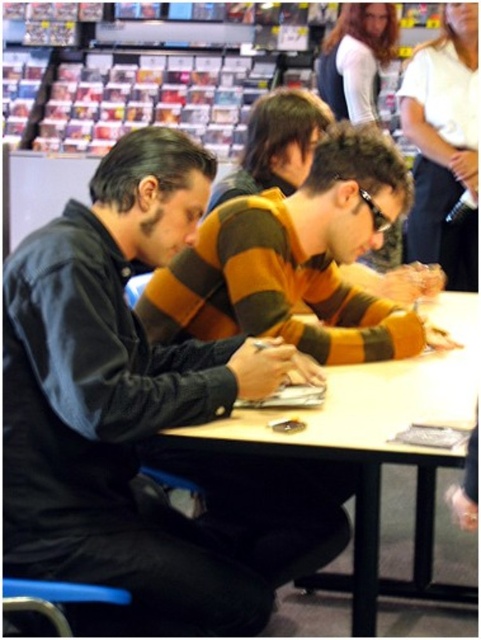
Is dark blue denim jacket at center to the right of light brown wood table at center from the viewer's perspective?

Incorrect, dark blue denim jacket at center is not on the right side of light brown wood table at center.

Describe the element at coordinates (118, 396) in the screenshot. I see `dark blue denim jacket at center` at that location.

Image resolution: width=481 pixels, height=640 pixels. I want to click on dark blue denim jacket at center, so click(x=118, y=396).